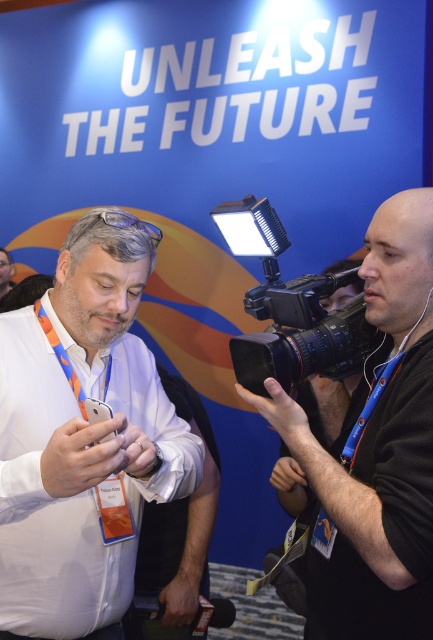
You are a photographer at the event and need to position yourself so that the white matte shirt at center and the black plastic video camera at center are both visible in your frame. Based on their positions, which object should be placed on the left side of your camera view?

The white matte shirt at center is to the left of the black plastic video camera at center, so you should position the white matte shirt at center on the left side of your camera view.

You are a photographer at the event and need to position your camera to capture the backdrop text. Where should you place the black matte camera at center to ensure the backdrop text is centered in the frame?

Place the black matte camera at center at point (374, 448) to ensure the backdrop text is centered in the frame.